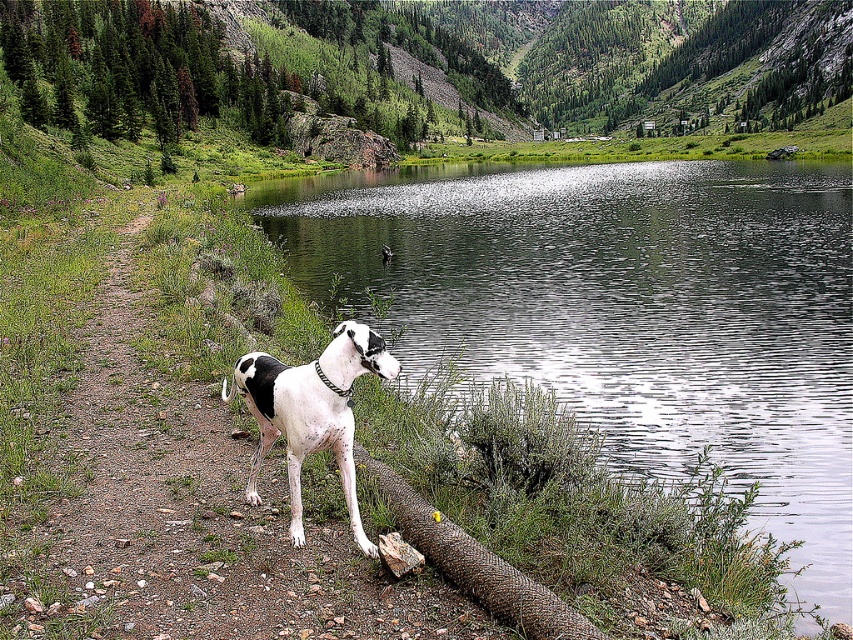
Question: Which point is closer to the camera taking this photo?

Choices:
 (A) (547, 630)
 (B) (732, 490)

Answer: (A)

Question: Is black and white fur at center wider than rustic wood log at lower center?

Choices:
 (A) no
 (B) yes

Answer: (B)

Question: Which object is the farthest from the clear water at lake left?

Choices:
 (A) black and white fur at center
 (B) rustic wood log at lower center

Answer: (B)

Question: Does clear water at lake left come in front of black and white fur at center?

Choices:
 (A) no
 (B) yes

Answer: (A)

Question: From the image, what is the correct spatial relationship of clear water at lake left in relation to black and white fur at center?

Choices:
 (A) left
 (B) right

Answer: (B)

Question: Which point is farther to the camera?

Choices:
 (A) black and white fur at center
 (B) clear water at lake left

Answer: (B)